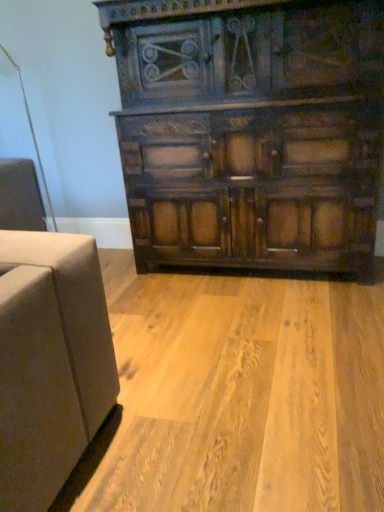
Describe the element at coordinates (250, 130) in the screenshot. The height and width of the screenshot is (512, 384). I see `dark wood cabinet at center` at that location.

The image size is (384, 512). In order to click on dark wood cabinet at center in this screenshot , I will do `click(250, 130)`.

What do you see at coordinates (245, 396) in the screenshot? I see `natural wood floor at center` at bounding box center [245, 396].

Identify the location of natural wood floor at center. The image size is (384, 512). (245, 396).

Image resolution: width=384 pixels, height=512 pixels. I want to click on dark wood cabinet at center, so click(250, 130).

Which object is positioned more to the left, dark wood cabinet at center or natural wood floor at center?

natural wood floor at center is more to the left.

Does dark wood cabinet at center come behind natural wood floor at center?

Yes, dark wood cabinet at center is further from the camera.

Does point (315, 49) come closer to viewer compared to point (165, 306)?

Yes, it is in front of point (165, 306).

From the image's perspective, which one is positioned higher, dark wood cabinet at center or natural wood floor at center?

dark wood cabinet at center, from the image's perspective.

From a real-world perspective, is dark wood cabinet at center on top of natural wood floor at center?

Correct, in the physical world, dark wood cabinet at center is higher than natural wood floor at center.

Does dark wood cabinet at center have a lesser width compared to natural wood floor at center?

Indeed, dark wood cabinet at center has a lesser width compared to natural wood floor at center.

Is dark wood cabinet at center taller than natural wood floor at center?

Indeed, dark wood cabinet at center has a greater height compared to natural wood floor at center.

Considering the sizes of objects dark wood cabinet at center and natural wood floor at center in the image provided, who is smaller, dark wood cabinet at center or natural wood floor at center?

natural wood floor at center.

Which is correct: dark wood cabinet at center is inside natural wood floor at center, or outside of it?

dark wood cabinet at center lies outside natural wood floor at center.

Would you say dark wood cabinet at center is a long distance from natural wood floor at center?

No, there isn't a large distance between dark wood cabinet at center and natural wood floor at center.

Is dark wood cabinet at center oriented towards natural wood floor at center?

Yes, dark wood cabinet at center faces towards natural wood floor at center.

How many degrees apart are the facing directions of dark wood cabinet at center and natural wood floor at center?

The facing directions of dark wood cabinet at center and natural wood floor at center are 88 degrees apart.

Find the location of a particular element. The height and width of the screenshot is (512, 384). chest of drawers on the right of natural wood floor at center is located at coordinates (250, 130).

Does natural wood floor at center appear on the left side of dark wood cabinet at center?

Indeed, natural wood floor at center is positioned on the left side of dark wood cabinet at center.

Which object is further away from the camera taking this photo, natural wood floor at center or dark wood cabinet at center?

dark wood cabinet at center is more distant.

Between point (218, 292) and point (376, 26), which one is positioned in front?

Positioned in front is point (376, 26).

From the image's perspective, relative to dark wood cabinet at center, is natural wood floor at center above or below?

Clearly, from the image's perspective, natural wood floor at center is below dark wood cabinet at center.

From a real-world perspective, which is physically above, natural wood floor at center or dark wood cabinet at center?

dark wood cabinet at center, from a real-world perspective.

Considering the sizes of objects natural wood floor at center and dark wood cabinet at center in the image provided, who is thinner, natural wood floor at center or dark wood cabinet at center?

dark wood cabinet at center is thinner.

Which of these two, natural wood floor at center or dark wood cabinet at center, stands shorter?

With less height is natural wood floor at center.

Looking at this image, can you confirm if natural wood floor at center is bigger than dark wood cabinet at center?

Incorrect, natural wood floor at center is not larger than dark wood cabinet at center.

Choose the correct answer: Is natural wood floor at center inside dark wood cabinet at center or outside it?

natural wood floor at center is not enclosed by dark wood cabinet at center.

Is natural wood floor at center next to dark wood cabinet at center and touching it?

No.

From the picture: Is natural wood floor at center oriented towards dark wood cabinet at center?

No, natural wood floor at center does not turn towards dark wood cabinet at center.

This screenshot has width=384, height=512. Find the location of `the chest of drawers that is above the natural wood floor at center (from a real-world perspective)`. the chest of drawers that is above the natural wood floor at center (from a real-world perspective) is located at coordinates (250, 130).

Identify the location of plywood lying below the dark wood cabinet at center (from the image's perspective). The image size is (384, 512). (245, 396).

Identify the location of plywood on the left of the dark wood cabinet at center. (245, 396).